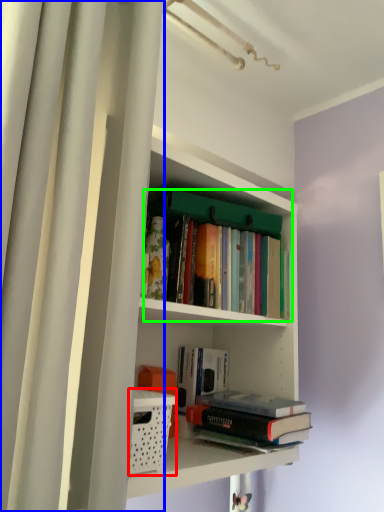
Question: Which is farther away from basket (highlighted by a red box)? shower curtain (highlighted by a blue box) or book (highlighted by a green box)?

Choices:
 (A) shower curtain
 (B) book

Answer: (B)